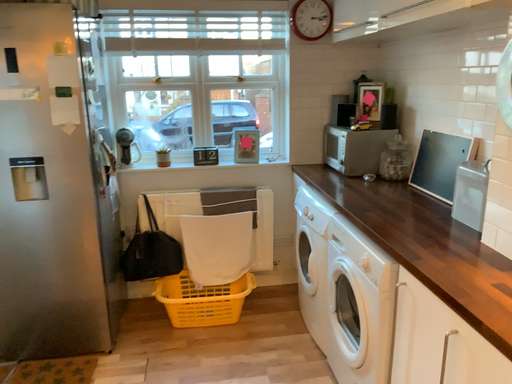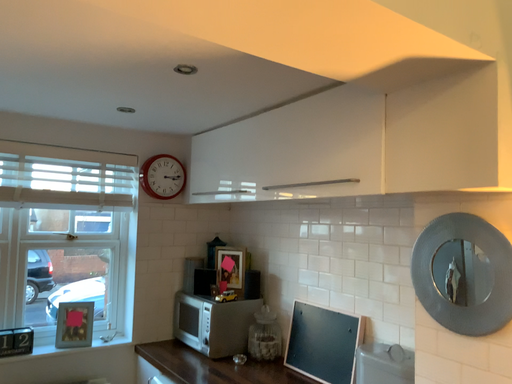
Question: How did the camera likely rotate when shooting the video?

Choices:
 (A) rotated left
 (B) rotated right

Answer: (B)